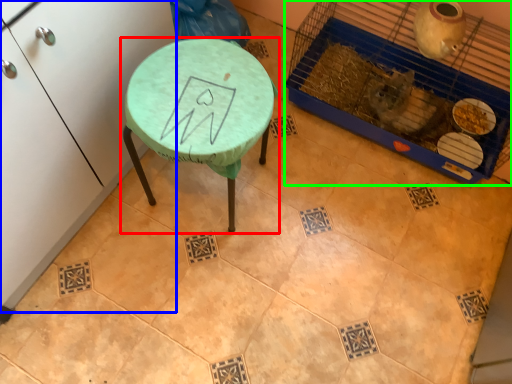
Question: Which is farther away from table (highlighted by a red box)? furniture (highlighted by a blue box) or bird cage (highlighted by a green box)?

Choices:
 (A) furniture
 (B) bird cage

Answer: (B)